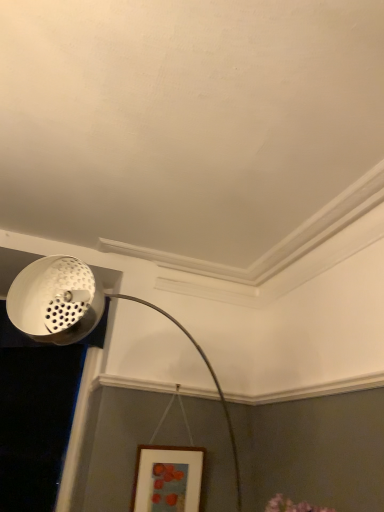
Question: From a real-world perspective, is white perforated metal at upper left physically located above or below white perforated lampshade at upper left?

Choices:
 (A) above
 (B) below

Answer: (A)

Question: Is white perforated metal at upper left taller or shorter than white perforated lampshade at upper left?

Choices:
 (A) tall
 (B) short

Answer: (B)

Question: Which object is the closest to the white perforated lampshade at upper left?

Choices:
 (A) wooden picture frame at lower center
 (B) white perforated metal at upper left

Answer: (B)

Question: Based on their relative distances, which object is nearer to the wooden picture frame at lower center?

Choices:
 (A) white perforated lampshade at upper left
 (B) white perforated metal at upper left

Answer: (A)